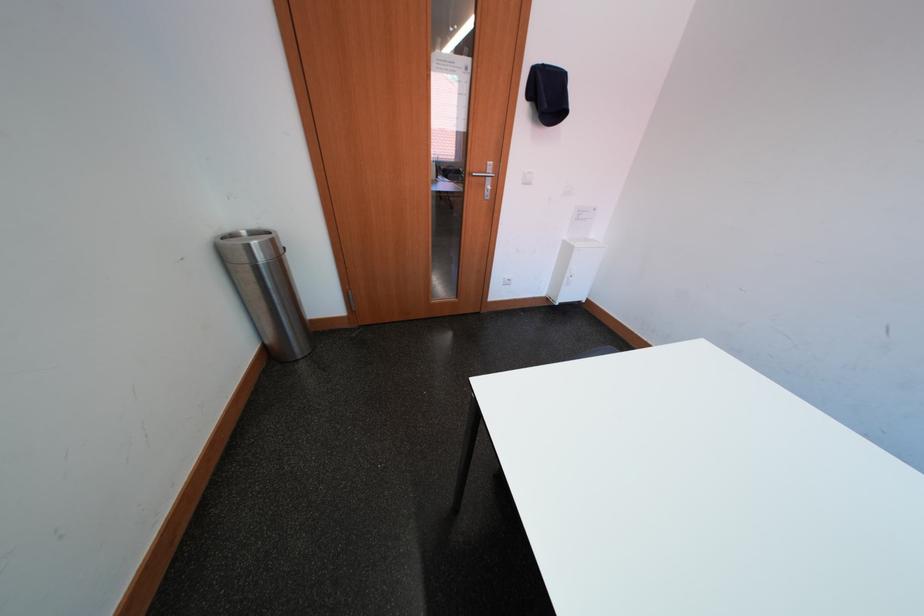
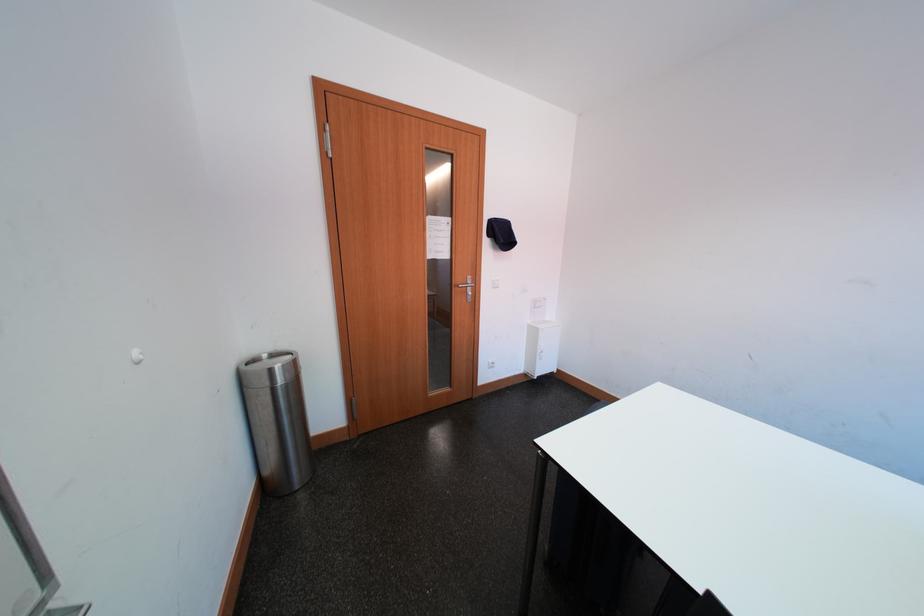
The point at (263, 248) is marked in the first image. Where is the corresponding point in the second image?

(286, 370)